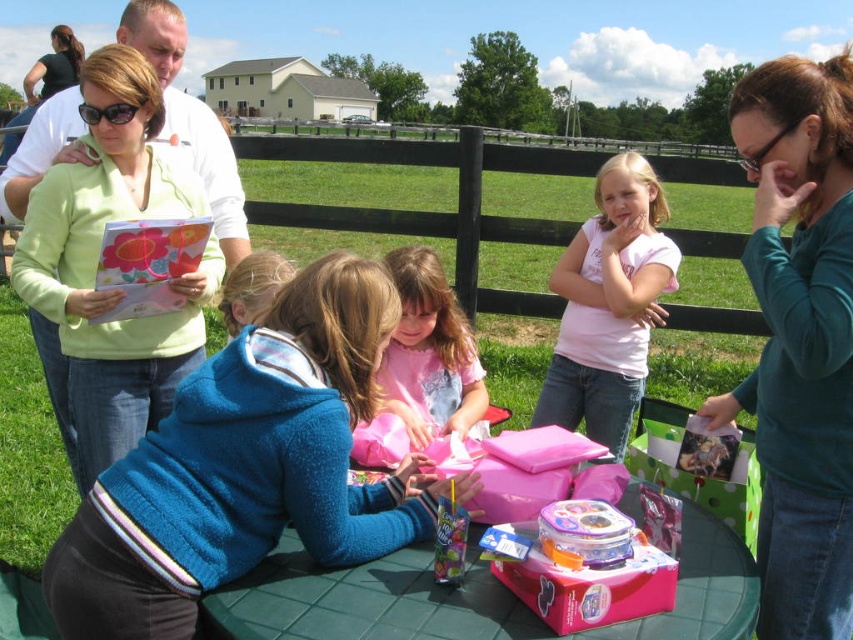
Question: From the image, what is the correct spatial relationship of pink plastic container at center in relation to translucent plastic toy at lower center?

Choices:
 (A) right
 (B) left

Answer: (A)

Question: Is pink fabric at center behind pink plastic container at center?

Choices:
 (A) no
 (B) yes

Answer: (B)

Question: Which object appears closest to the camera in this image?

Choices:
 (A) pink satin dress at center
 (B) matte green sweater at upper left

Answer: (A)

Question: Can you confirm if teal matte shirt at upper right is positioned above pink satin dress at center?

Choices:
 (A) no
 (B) yes

Answer: (B)

Question: Which object is closer to the camera taking this photo?

Choices:
 (A) matte green sweater at upper left
 (B) green plastic table at center
 (C) teal matte shirt at upper right

Answer: (B)

Question: Which object is positioned farthest from the pink plastic container at center?

Choices:
 (A) pink satin dress at center
 (B) matte green sweater at upper left
 (C) teal matte shirt at upper right
 (D) green plastic table at center

Answer: (B)